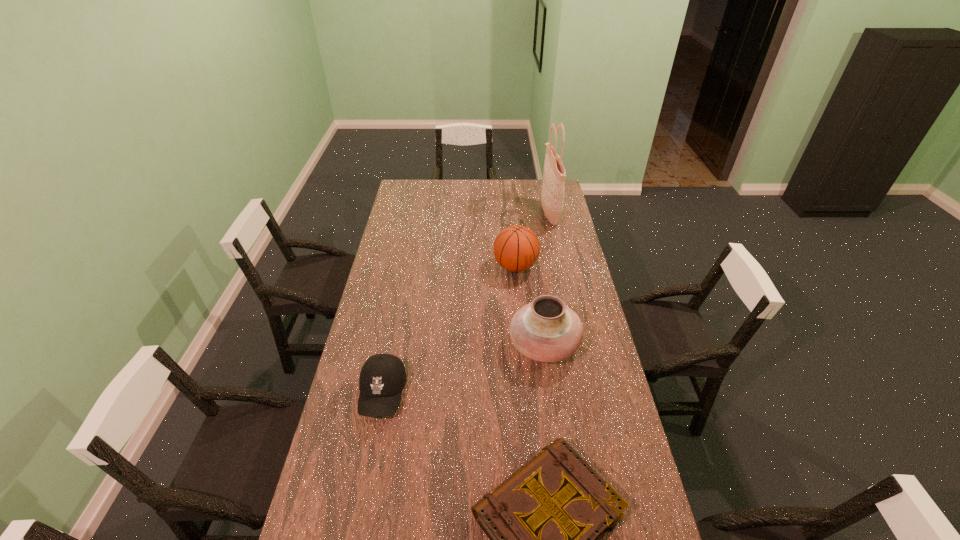
Find the location of `free space that is in between the second shortest object and the shopping bag`. free space that is in between the second shortest object and the shopping bag is located at coordinates (467, 304).

Find the location of a particular element. The height and width of the screenshot is (540, 960). the second closest object to the basketball is located at coordinates (546, 330).

You are a GUI agent. You are given a task and a screenshot of the screen. Output one action in this format:
    pyautogui.click(x=<x>, y=<y>)
    Task: Click on the fourth closest object to the leftmost object
    This screenshot has width=960, height=540.
    Given the screenshot: What is the action you would take?
    pyautogui.click(x=552, y=197)